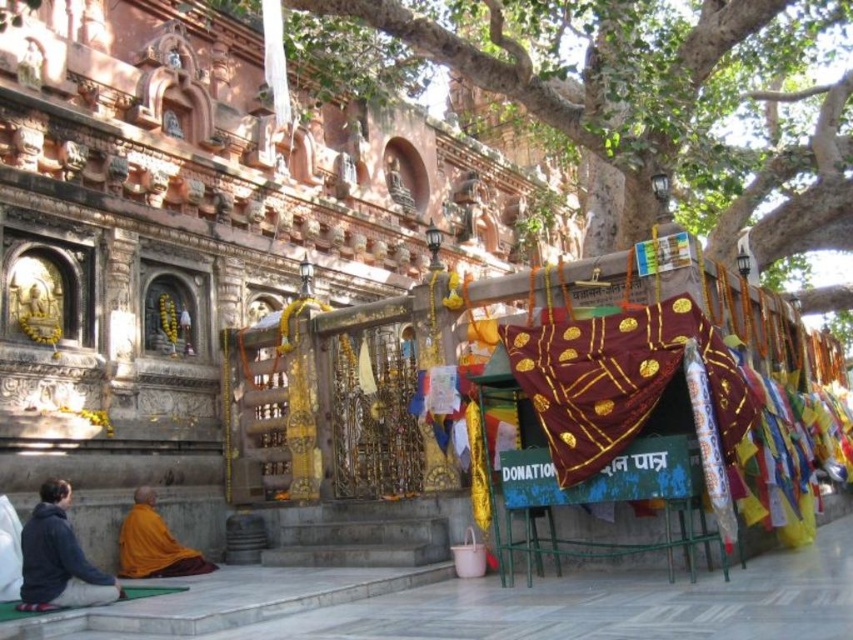
Question: Estimate the real-world distances between objects in this image. Which object is closer to the green leafy tree at upper center?

Choices:
 (A) orange cloth monk at lower left
 (B) dark blue hoodie at lower left

Answer: (B)

Question: Is green leafy tree at upper center bigger than dark blue hoodie at lower left?

Choices:
 (A) no
 (B) yes

Answer: (B)

Question: Can you confirm if green leafy tree at upper center is smaller than dark blue hoodie at lower left?

Choices:
 (A) yes
 (B) no

Answer: (B)

Question: Is green leafy tree at upper center positioned in front of dark blue hoodie at lower left?

Choices:
 (A) no
 (B) yes

Answer: (A)

Question: Which of the following is the farthest from the observer?

Choices:
 (A) green leafy tree at upper center
 (B) orange cloth monk at lower left

Answer: (A)

Question: Based on their relative distances, which object is nearer to the dark blue hoodie at lower left?

Choices:
 (A) orange cloth monk at lower left
 (B) green leafy tree at upper center

Answer: (A)